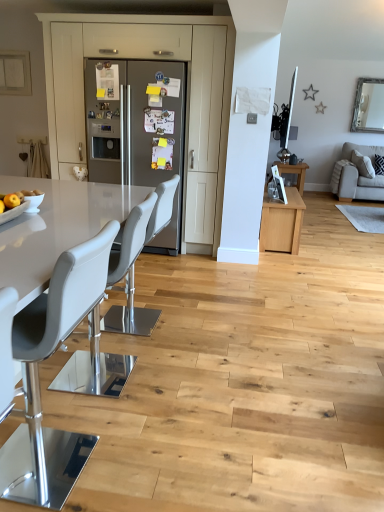
The image size is (384, 512). In order to click on vacant area on the back side of gray leather chair at left, which appears as the 1th chair when viewed from the front in this screenshot , I will do `click(90, 411)`.